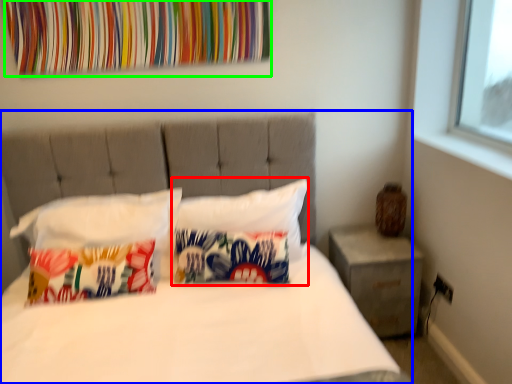
Question: Which is farther away from pillow (highlighted by a red box)? bed (highlighted by a blue box) or tapestry (highlighted by a green box)?

Choices:
 (A) bed
 (B) tapestry

Answer: (B)